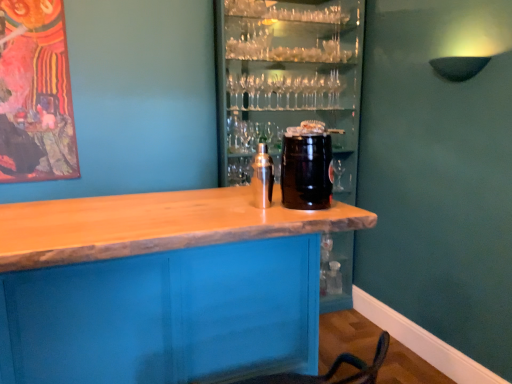
Image resolution: width=512 pixels, height=384 pixels. What are the coordinates of `vacant region in front of black matte keg at center, acting as the 2th beverage starting from the left` in the screenshot? It's located at (304, 213).